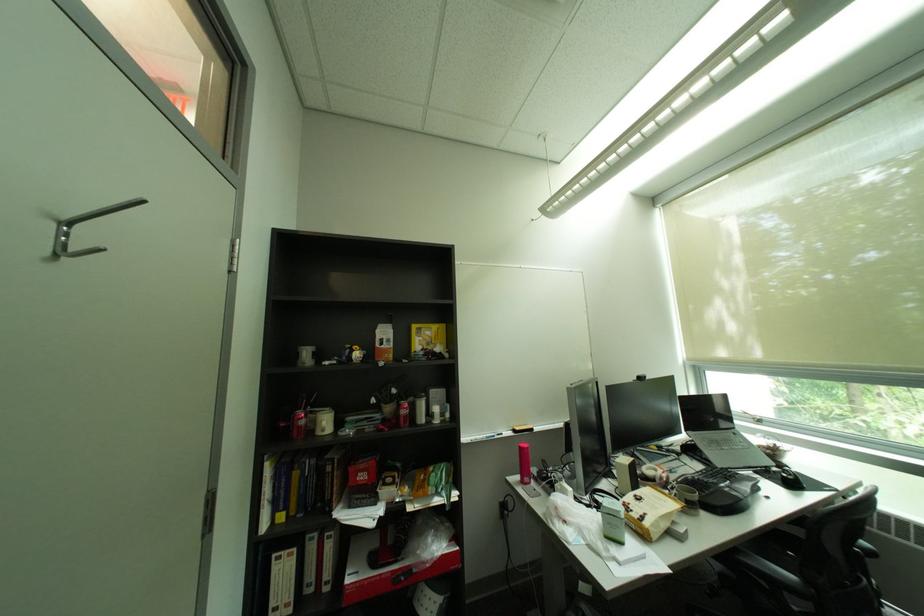
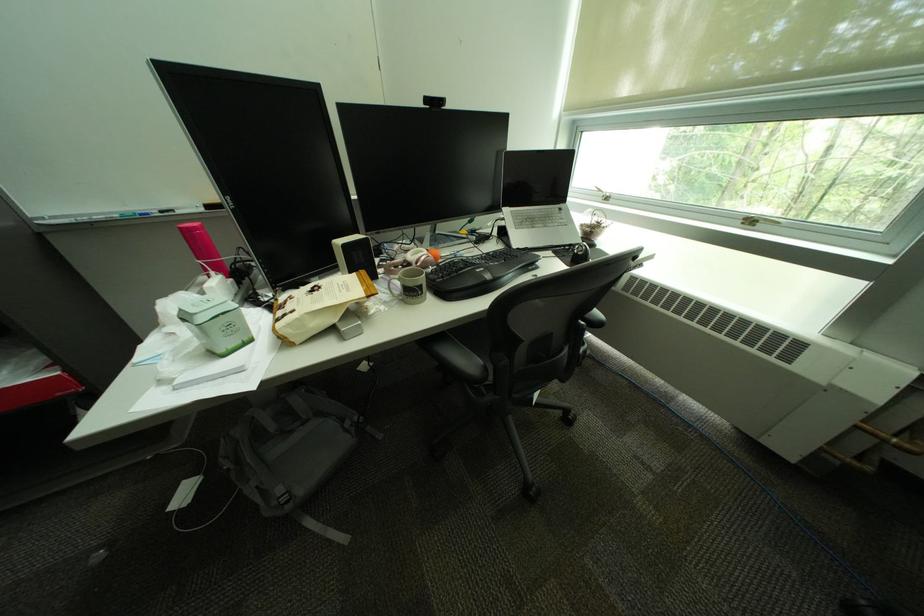
In the second image, find the point that corresponds to (701,440) in the first image.

(514, 217)